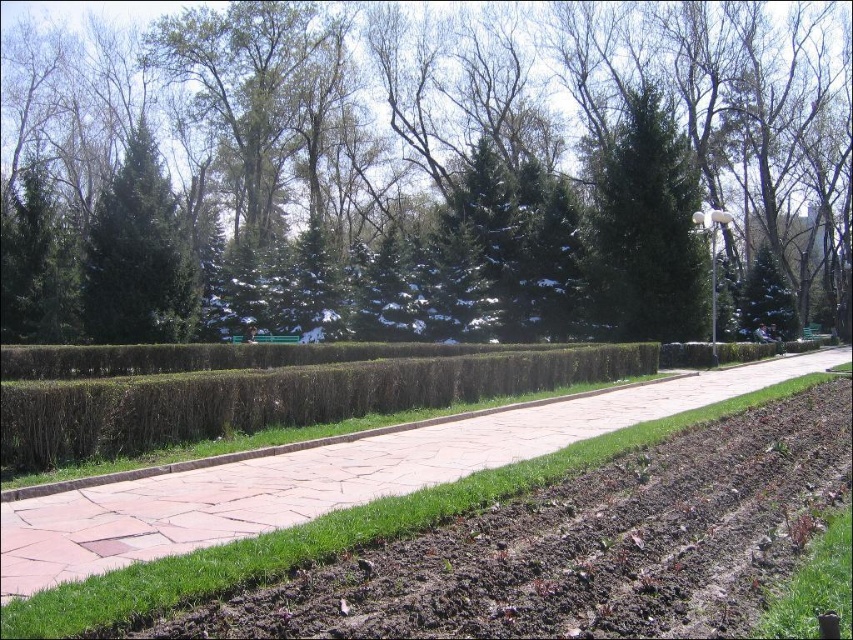
Question: Is brown textured hedge at center bigger than brown soil at center?

Choices:
 (A) yes
 (B) no

Answer: (A)

Question: Does green needle-like at center have a larger size compared to green textured evergreen tree at upper left?

Choices:
 (A) yes
 (B) no

Answer: (B)

Question: Which point is closer to the camera?

Choices:
 (A) green textured hedge at center
 (B) green textured evergreen tree at upper left
 (C) brown textured hedge at center
 (D) green needle-like at center

Answer: (C)

Question: Estimate the real-world distances between objects in this image. Which object is farther from the green textured hedge at center?

Choices:
 (A) green textured evergreen tree at upper left
 (B) green needle-like at center
 (C) brown soil at center
 (D) brown textured hedge at center

Answer: (C)

Question: Estimate the real-world distances between objects in this image. Which object is farther from the brown soil at center?

Choices:
 (A) green textured evergreen tree at upper left
 (B) green needle-like at center
 (C) brown textured hedge at center
 (D) green textured hedge at center

Answer: (D)

Question: Can you confirm if brown soil at center is bigger than green needle-like at center?

Choices:
 (A) yes
 (B) no

Answer: (B)